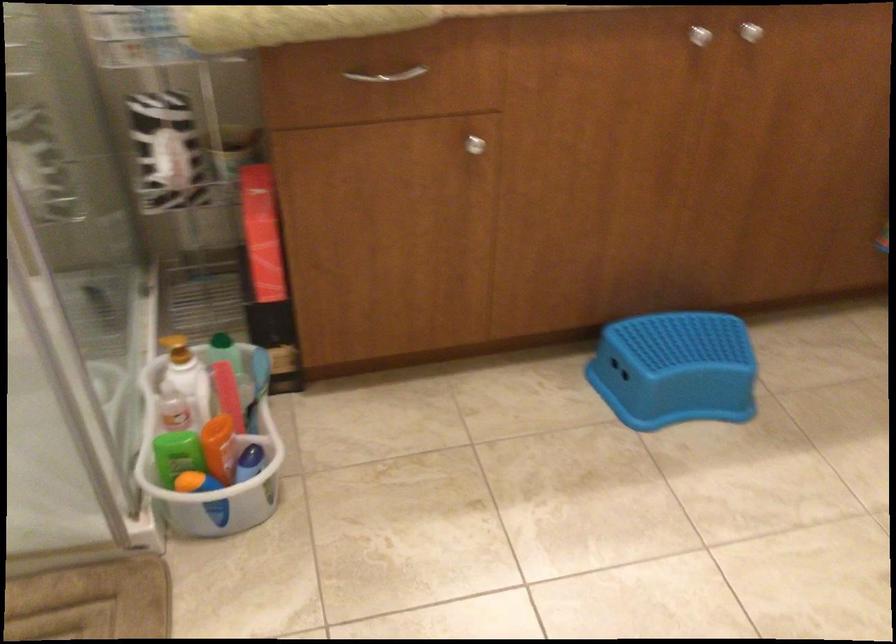
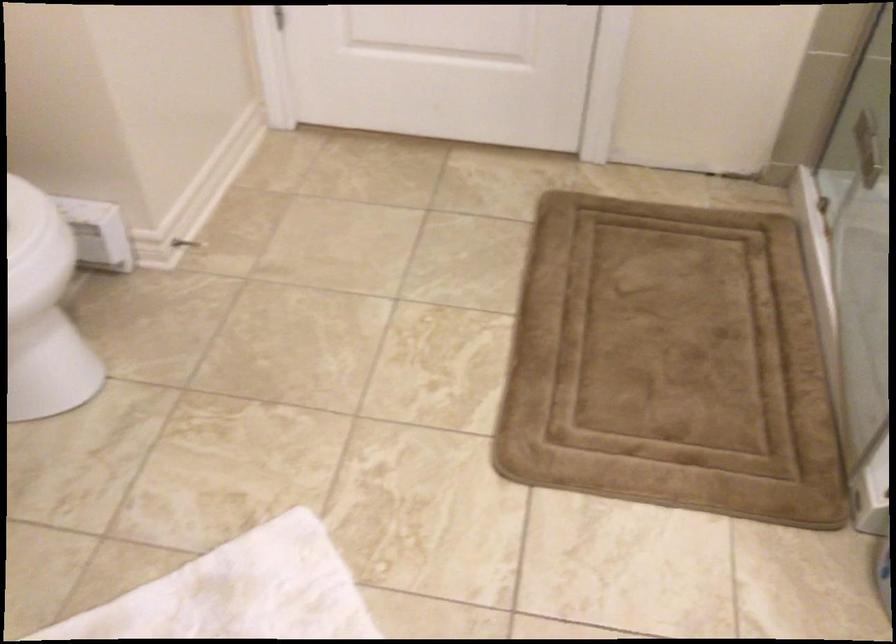
The first image is from the beginning of the video and the second image is from the end. How did the camera likely rotate when shooting the video?

The camera rotated toward left-down.